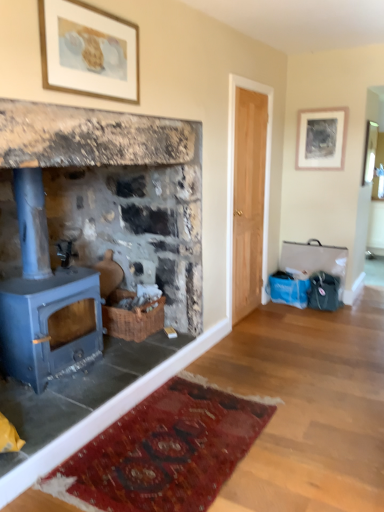
Question: Is blue painted wood stove at left thinner than matte blue wood burning stove at left?

Choices:
 (A) yes
 (B) no

Answer: (B)

Question: Is blue painted wood stove at left smaller than matte blue wood burning stove at left?

Choices:
 (A) yes
 (B) no

Answer: (B)

Question: Is blue painted wood stove at left aimed at matte blue wood burning stove at left?

Choices:
 (A) no
 (B) yes

Answer: (B)

Question: Is blue painted wood stove at left wider than matte blue wood burning stove at left?

Choices:
 (A) no
 (B) yes

Answer: (B)

Question: Are blue painted wood stove at left and matte blue wood burning stove at left beside each other?

Choices:
 (A) no
 (B) yes

Answer: (A)

Question: From the image's perspective, would you say blue painted wood stove at left is shown under matte blue wood burning stove at left?

Choices:
 (A) yes
 (B) no

Answer: (B)

Question: From a real-world perspective, is matte silver picture frame at upper right, the second picture frame viewed from the left, over gold-framed artwork at upper center, arranged as the first picture frame when viewed from the front?

Choices:
 (A) no
 (B) yes

Answer: (A)

Question: Is there a large distance between matte silver picture frame at upper right, which is the 1th picture frame in back-to-front order, and gold-framed artwork at upper center, arranged as the first picture frame when viewed from the front?

Choices:
 (A) no
 (B) yes

Answer: (B)

Question: Can you confirm if matte silver picture frame at upper right, the second picture frame viewed from the left, is shorter than gold-framed artwork at upper center, which is the 2th picture frame from back to front?

Choices:
 (A) no
 (B) yes

Answer: (A)

Question: Does matte silver picture frame at upper right, the first picture frame positioned from the right, have a smaller size compared to gold-framed artwork at upper center, placed as the second picture frame when sorted from right to left?

Choices:
 (A) yes
 (B) no

Answer: (A)

Question: Can you confirm if matte silver picture frame at upper right, the 2th picture frame positioned from the front, is bigger than gold-framed artwork at upper center, which is the 2th picture frame from back to front?

Choices:
 (A) yes
 (B) no

Answer: (B)

Question: Is matte silver picture frame at upper right, the 2th picture frame positioned from the front, directly adjacent to gold-framed artwork at upper center, arranged as the first picture frame when viewed from the front?

Choices:
 (A) yes
 (B) no

Answer: (B)

Question: Can you confirm if blue painted wood stove at left is bigger than gold-framed artwork at upper center, which is counted as the 1th picture frame, starting from the left?

Choices:
 (A) no
 (B) yes

Answer: (B)